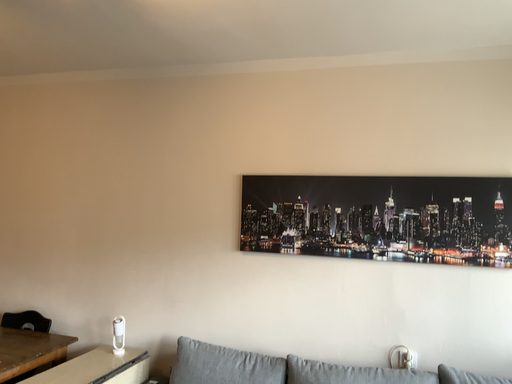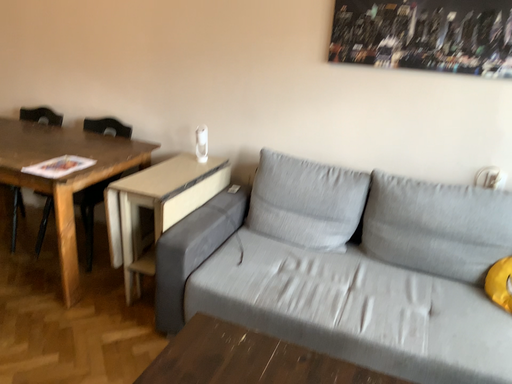
Question: Which way did the camera rotate in the video?

Choices:
 (A) rotated downward
 (B) rotated upward

Answer: (A)